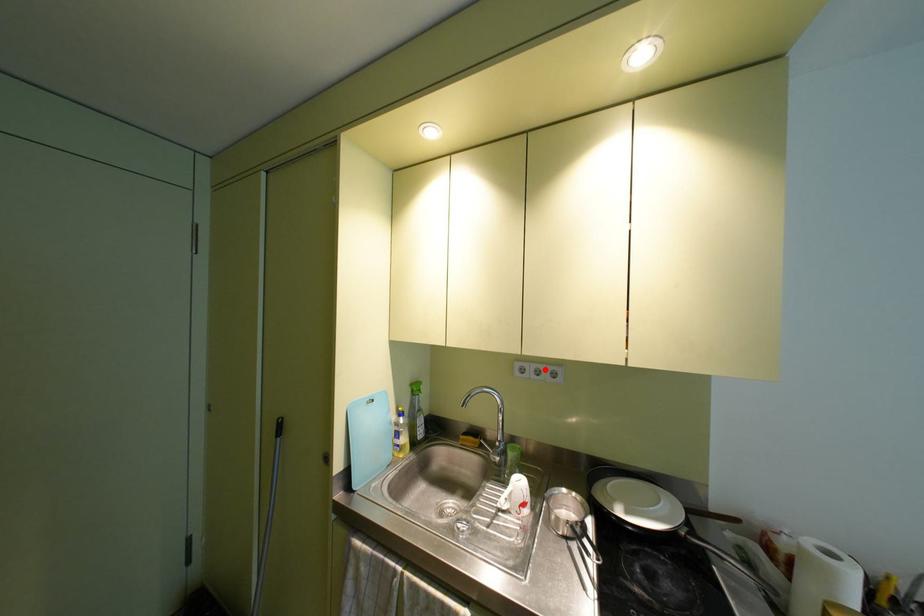
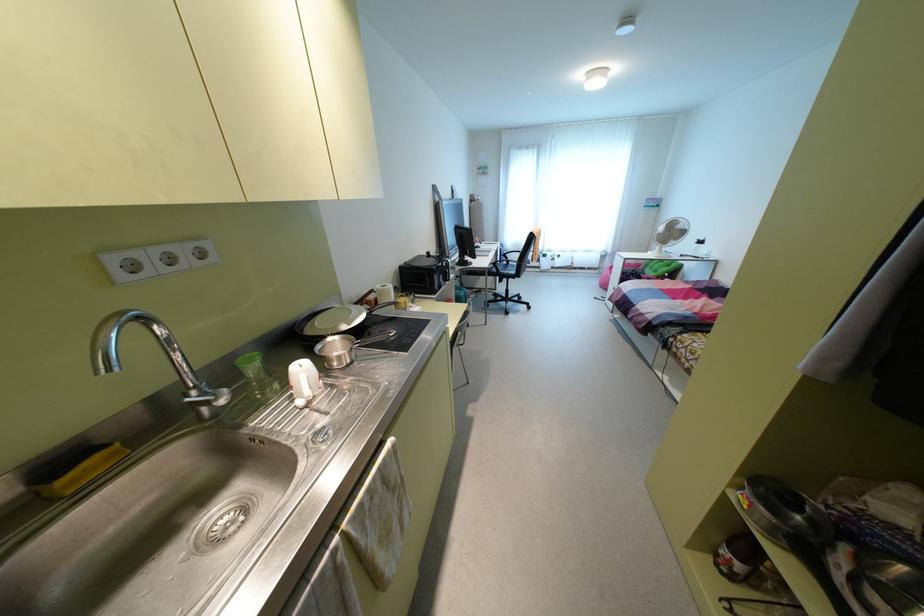
The point at the highlighted location is marked in the first image. Where is the corresponding point in the second image?

(181, 251)